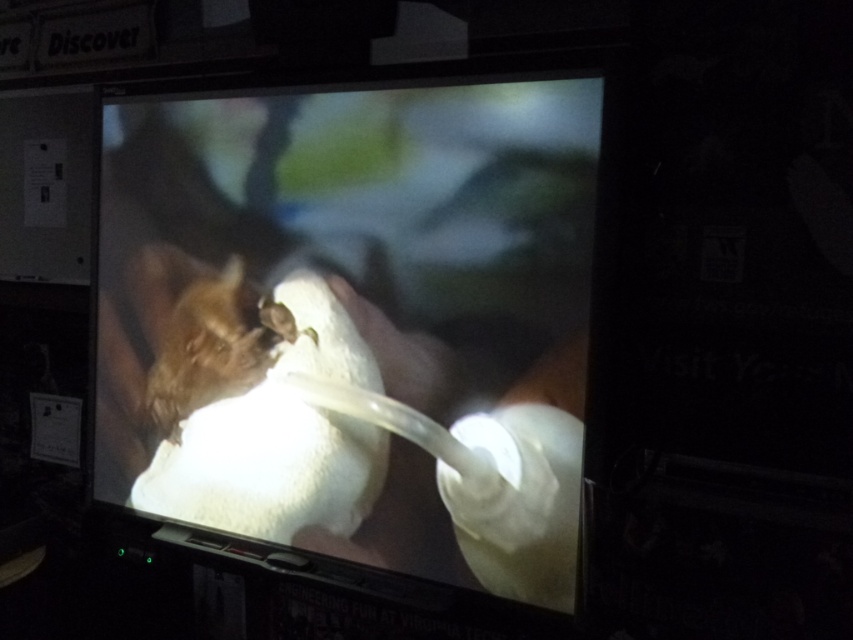
You are a caregiver trying to feed the brown fur animal at center using the white plastic bottle at center. Considering the size difference between the two, will the bottle be too big for the animal to hold comfortably?

The white plastic bottle at center is larger in size than the brown fur animal at center, so it might be too big for the animal to hold comfortably.

You are a caretaker in the room and need to check if the brown fur animal at center can reach the white plastic bottle at center. Based on their positions, can the animal access the bottle?

The white plastic bottle at center is in front of the brown fur animal at center, so the animal is behind the bottle. Since the bottle is in front, the animal can easily reach it.

You are standing in front of the television and want to touch the point at coordinates point (287, 529) on the TV screen. If you can reach up to 1.4 meters, will you be able to reach it?

The point (287, 529) and camera are 1.45 meters apart, so you cannot reach it since your maximum reach is 1.4 meters.